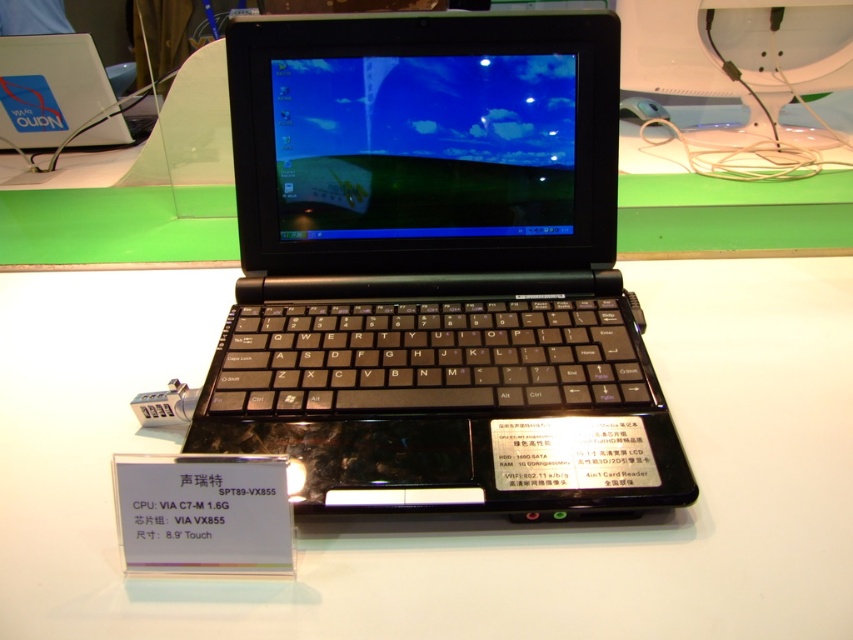
You are setting up a display at a tech exhibition and need to arrange the black plastic laptop at center and the black plastic table at center. Given their sizes, which object should you place first to ensure proper fitting?

The black plastic laptop at center occupies less space than the black plastic table at center, so you should place the black plastic table at center first to ensure there is enough space for both items.

You are a tech enthusiast visiting a tech exhibition. You see a black plastic laptop at center and a black plastic table at center. Which object is located to the right side of the other?

The black plastic laptop at center is positioned on the right side of black plastic table at center.

You are a tech enthusiast at a trade show and want to know if the black plastic laptop at center can be placed on the black plastic table at center without falling off. Considering the height difference between them, what should you be cautious about?

The black plastic laptop at center is taller than the black plastic table at center, so placing it directly on the table might cause instability due to the laptop being higher. Ensure the table can support its height and weight properly to prevent tipping over.